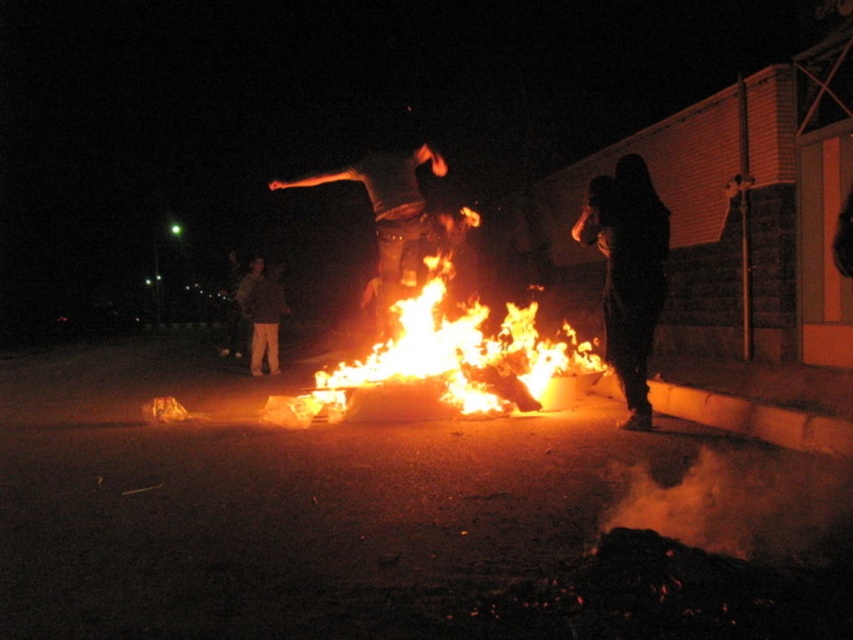
You are a photographer trying to capture the scene with two people near the fire. You notice a specific point marked at coordinates point (628, 273). According to the image, where is this point located?

The point (628, 273) is located on the black matte figure at right.

You are a photographer trying to capture the scene of the fire. You notice two people in the image. One is the black matte figure at right and the other is the dark brown fabric pants at lower left. Which person is closer to the right edge of the photo?

The black matte figure at right is positioned on the right side of dark brown fabric pants at lower left, so the black matte figure at right is closer to the right edge of the photo.

You are a photographer trying to capture the fire scene. You have two subjects in your frame, the flaming wood at center and the dark gray jeans at center. Which object appears narrower in your photo?

The flaming wood at center appears narrower because it has a lesser width compared to the dark gray jeans at center.